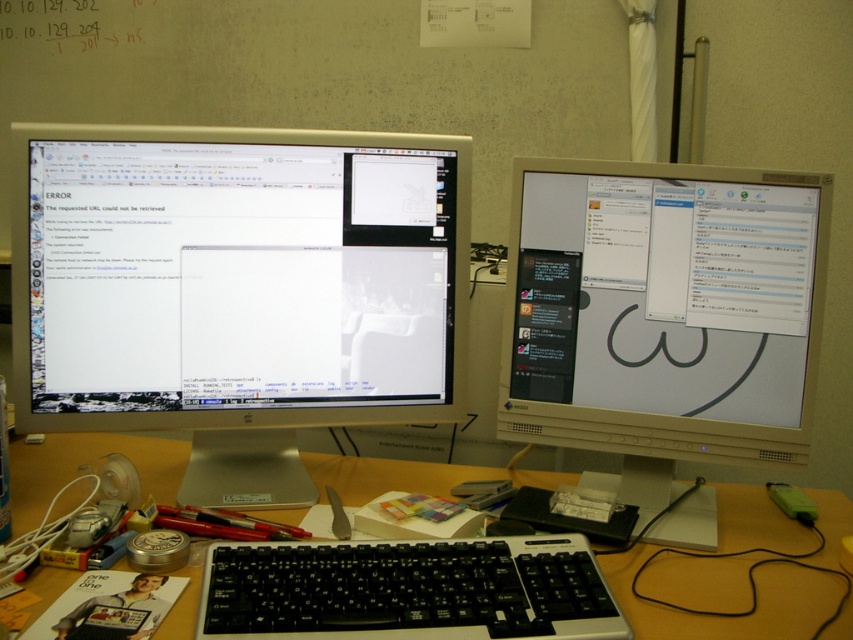
You are standing in front of the workspace shown in the image. There is a point marked at coordinates (730, 618). What object is located at that point?

The point at coordinates (730, 618) indicates the wooden desk at center.

Based on the photo, you are standing 5 feet away from the desk. You want to reach the satin silver monitor at left to fix the error message. Can you step closer to the monitor without moving any objects on the desk?

The satin silver monitor at left is 3.28 feet away from the viewer. Since you are currently 5 feet away from the desk, you can step closer to the monitor as long as you don not move any objects on the desk.